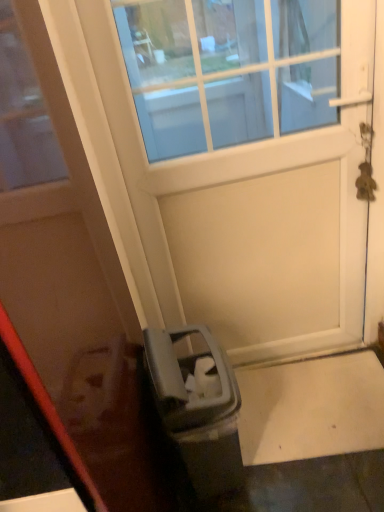
Question: Can you confirm if white matte door at center, positioned as the 1th door in left-to-right order, is bigger than white matte door at center, which is the 1th door from right to left?

Choices:
 (A) yes
 (B) no

Answer: (A)

Question: Can you confirm if white matte door at center, which appears as the second door when viewed from the right, is shorter than white matte door at center, which is the 1th door from right to left?

Choices:
 (A) yes
 (B) no

Answer: (B)

Question: From the image's perspective, is white matte door at center, which appears as the second door when viewed from the right, beneath white matte door at center, which is the 1th door from right to left?

Choices:
 (A) no
 (B) yes

Answer: (B)

Question: Is white matte door at center, positioned as the 1th door in left-to-right order, positioned with its back to white matte door at center, which is counted as the 2th door, starting from the left?

Choices:
 (A) yes
 (B) no

Answer: (B)

Question: Are white matte door at center, which appears as the second door when viewed from the right, and white matte door at center, which is counted as the 2th door, starting from the left, far apart?

Choices:
 (A) no
 (B) yes

Answer: (A)

Question: Is white matte door at center, which appears as the second door when viewed from the right, to the right of white matte door at center, which is counted as the 2th door, starting from the left, from the viewer's perspective?

Choices:
 (A) no
 (B) yes

Answer: (A)

Question: Can you confirm if white matte door at center, which is the 1th door from right to left, is taller than white matte door at center, positioned as the 1th door in left-to-right order?

Choices:
 (A) no
 (B) yes

Answer: (A)

Question: From a real-world perspective, is white matte door at center, which is the 1th door from right to left, over white matte door at center, which appears as the second door when viewed from the right?

Choices:
 (A) no
 (B) yes

Answer: (A)

Question: Is white matte door at center, which is the 1th door from right to left, outside of white matte door at center, which appears as the second door when viewed from the right?

Choices:
 (A) no
 (B) yes

Answer: (B)

Question: Is white matte door at center, which is the 1th door from right to left, smaller than white matte door at center, which appears as the second door when viewed from the right?

Choices:
 (A) no
 (B) yes

Answer: (B)

Question: Is there a large distance between white matte door at center, which is counted as the 2th door, starting from the left, and white matte door at center, which appears as the second door when viewed from the right?

Choices:
 (A) yes
 (B) no

Answer: (B)

Question: Can you confirm if white matte door at center, which is the 1th door from right to left, is thinner than white matte door at center, positioned as the 1th door in left-to-right order?

Choices:
 (A) no
 (B) yes

Answer: (B)

Question: In the image, is white matte door at center, which is the 1th door from right to left, on the left side or the right side of white matte door at center, positioned as the 1th door in left-to-right order?

Choices:
 (A) left
 (B) right

Answer: (B)